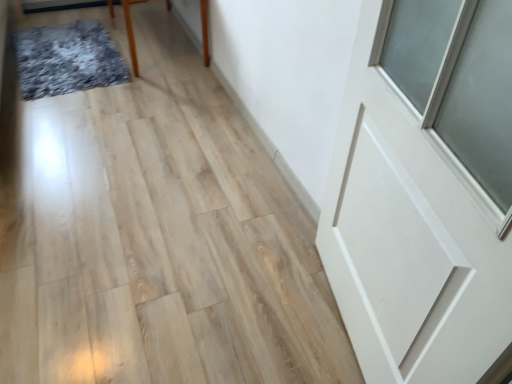
Question: Does brown wooden table at upper left lie behind white matte door at upper right?

Choices:
 (A) yes
 (B) no

Answer: (A)

Question: Can you confirm if brown wooden table at upper left is taller than white matte door at upper right?

Choices:
 (A) yes
 (B) no

Answer: (B)

Question: From the image's perspective, would you say brown wooden table at upper left is positioned over white matte door at upper right?

Choices:
 (A) no
 (B) yes

Answer: (B)

Question: Are brown wooden table at upper left and white matte door at upper right located far from each other?

Choices:
 (A) no
 (B) yes

Answer: (B)

Question: Is brown wooden table at upper left looking in the opposite direction of white matte door at upper right?

Choices:
 (A) no
 (B) yes

Answer: (A)

Question: From a real-world perspective, is brown wooden table at upper left physically located above or below white matte door at upper right?

Choices:
 (A) below
 (B) above

Answer: (A)

Question: From their relative heights in the image, would you say brown wooden table at upper left is taller or shorter than white matte door at upper right?

Choices:
 (A) short
 (B) tall

Answer: (A)

Question: Is brown wooden table at upper left spatially inside white matte door at upper right, or outside of it?

Choices:
 (A) inside
 (B) outside

Answer: (B)

Question: Based on their sizes in the image, would you say brown wooden table at upper left is bigger or smaller than white matte door at upper right?

Choices:
 (A) big
 (B) small

Answer: (A)

Question: In terms of size, does textured gray mat at upper left appear bigger or smaller than white matte door at upper right?

Choices:
 (A) small
 (B) big

Answer: (A)

Question: In the image, is textured gray mat at upper left positioned in front of or behind white matte door at upper right?

Choices:
 (A) front
 (B) behind

Answer: (B)

Question: Is textured gray mat at upper left wider or thinner than white matte door at upper right?

Choices:
 (A) wide
 (B) thin

Answer: (A)

Question: Would you say textured gray mat at upper left is inside or outside white matte door at upper right?

Choices:
 (A) inside
 (B) outside

Answer: (B)

Question: Considering the positions of white matte door at upper right and textured gray mat at upper left in the image, is white matte door at upper right taller or shorter than textured gray mat at upper left?

Choices:
 (A) tall
 (B) short

Answer: (A)

Question: From a real-world perspective, relative to textured gray mat at upper left, is white matte door at upper right vertically above or below?

Choices:
 (A) above
 (B) below

Answer: (A)